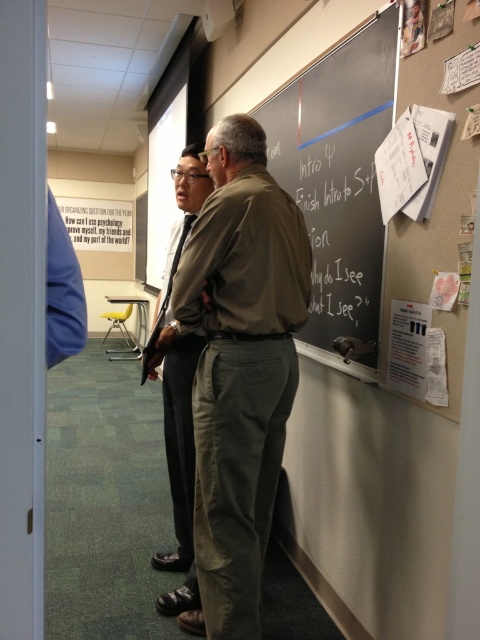
Between black chalkboard at upper center and white paper at right, which one appears on the left side from the viewer's perspective?

From the viewer's perspective, black chalkboard at upper center appears more on the left side.

Consider the image. Who is more distant from viewer, [356,289] or [421,394]?

The point [356,289] is behind.

Between point (312, 164) and point (403, 326), which one is positioned behind?

Positioned behind is point (312, 164).

Where is `black chalkboard at upper center`? black chalkboard at upper center is located at coordinates (338, 180).

Can you confirm if matte khaki pants at center is positioned to the left of white paper at right?

Correct, you'll find matte khaki pants at center to the left of white paper at right.

Can you confirm if matte khaki pants at center is positioned to the right of white paper at right?

Incorrect, matte khaki pants at center is not on the right side of white paper at right.

Is point (177, 484) closer to camera compared to point (398, 300)?

No.

The height and width of the screenshot is (640, 480). Identify the location of matte khaki pants at center. (180, 470).

Does black chalkboard at upper center have a larger size compared to black chalkboard writing at upper center?

Correct, black chalkboard at upper center is larger in size than black chalkboard writing at upper center.

At what (x,y) coordinates should I click in order to perform the action: click on black chalkboard at upper center. Please return your answer as a coordinate pair (x, y). Looking at the image, I should click on tap(338, 180).

Locate an element on the screen. The height and width of the screenshot is (640, 480). black chalkboard at upper center is located at coordinates (338, 180).